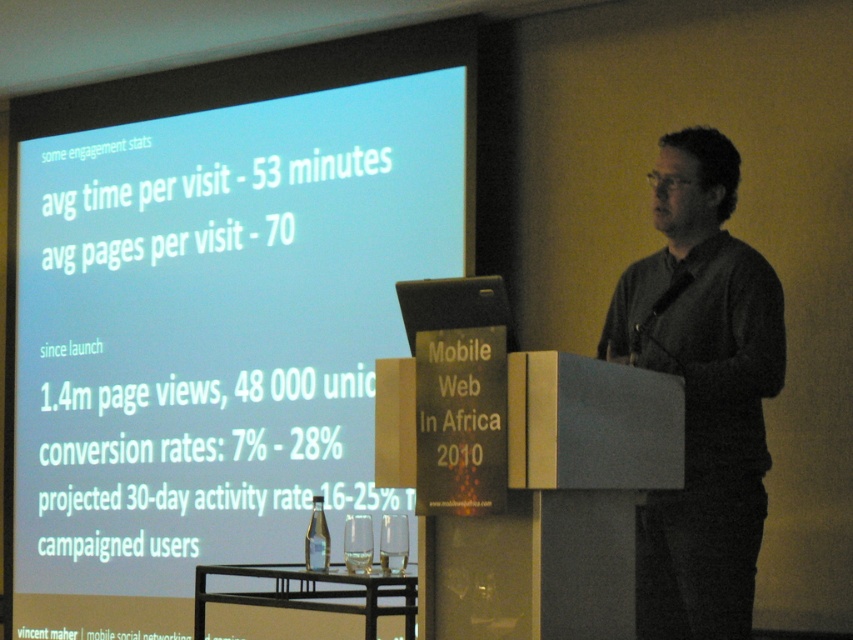
Can you confirm if transparent glass at lower center is thinner than transparent glass at center?

Yes, transparent glass at lower center is thinner than transparent glass at center.

Looking at this image, between transparent glass at lower center and transparent glass at center, which one is positioned higher?

transparent glass at lower center is higher up.

Where is `transparent glass at lower center`? transparent glass at lower center is located at coordinates [x=358, y=544].

Based on the photo, which is more to the left, dark gray sweater at center or black wood podium at center?

Positioned to the left is black wood podium at center.

Describe the element at coordinates (701, 390) in the screenshot. This screenshot has width=853, height=640. I see `dark gray sweater at center` at that location.

Between point (659, 342) and point (369, 595), which one is positioned in front?

Positioned in front is point (369, 595).

This screenshot has width=853, height=640. In order to click on dark gray sweater at center in this screenshot , I will do `click(701, 390)`.

Which of these two, white matte projection screen at upper left or clear glass bottle at center, stands taller?

Standing taller between the two is white matte projection screen at upper left.

Which is behind, point (436, 209) or point (328, 541)?

The point (436, 209) is more distant.

Between point (407, 230) and point (310, 536), which one is positioned behind?

Point (407, 230)

The image size is (853, 640). Identify the location of white matte projection screen at upper left. (213, 310).